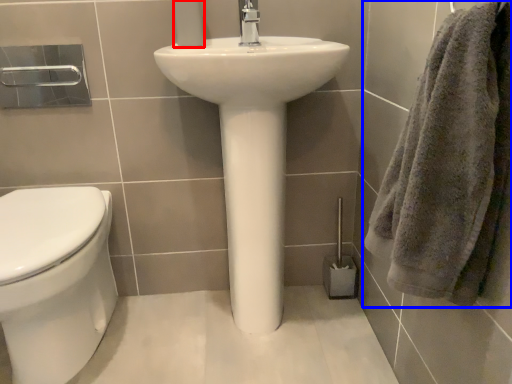
Question: Among these objects, which one is nearest to the camera, toilet paper (highlighted by a red box) or towel (highlighted by a blue box)?

Choices:
 (A) toilet paper
 (B) towel

Answer: (B)